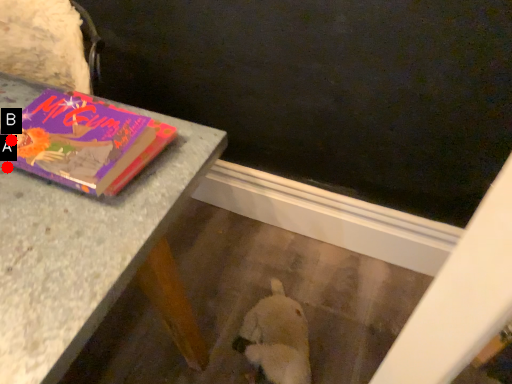
Question: Two points are circled on the image, labeled by A and B beside each circle. Which point appears closest to the camera in this image?

Choices:
 (A) A is closer
 (B) B is closer

Answer: (A)